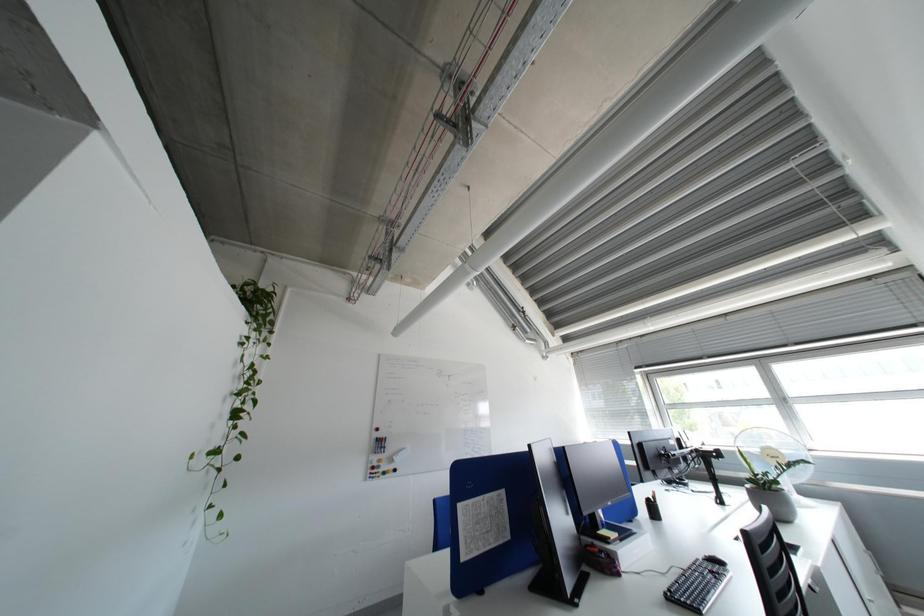
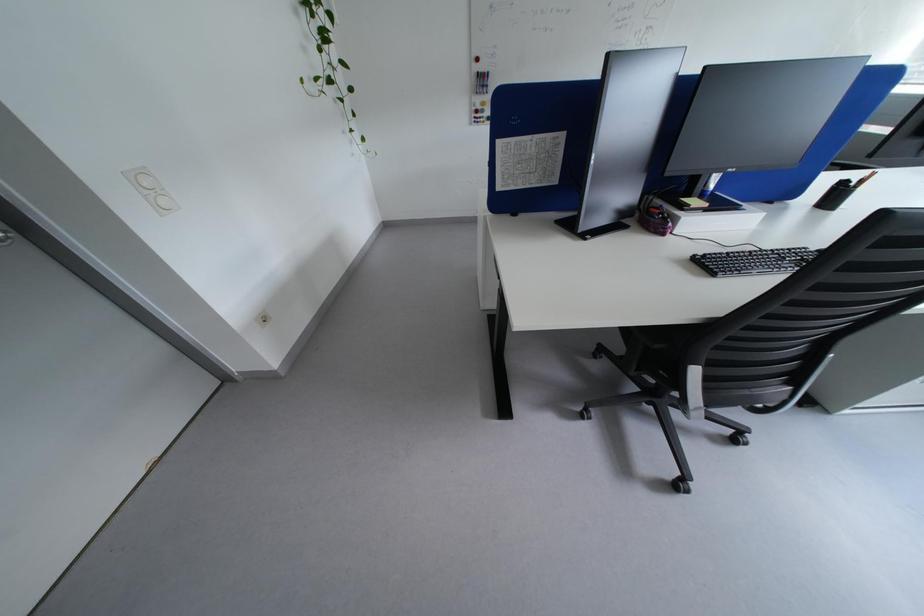
Based on the continuous images, in which direction is the camera rotating?

The camera rotated toward left-down.